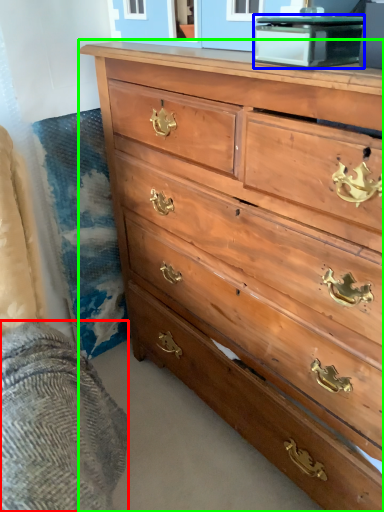
Question: Considering the real-world distances, which object is farthest from bedding (highlighted by a red box)? cabinetry (highlighted by a blue box) or chest of drawers (highlighted by a green box)?

Choices:
 (A) cabinetry
 (B) chest of drawers

Answer: (A)